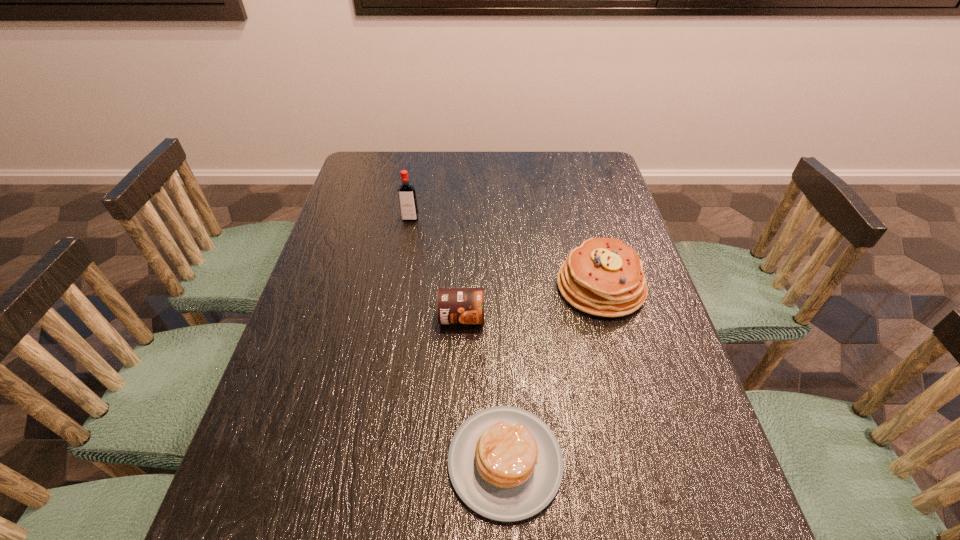
This screenshot has height=540, width=960. What are the coordinates of `free space that is in between the can and the taller pancake` in the screenshot? It's located at (531, 302).

This screenshot has height=540, width=960. In order to click on vacant area that lies between the nearest object and the leftmost object in this screenshot , I will do `click(458, 340)`.

Find the location of `free space that is in between the left pancake and the second shortest object`. free space that is in between the left pancake and the second shortest object is located at coordinates (484, 389).

Locate an element on the screen. This screenshot has height=540, width=960. unoccupied position between the can and the right pancake is located at coordinates (531, 302).

Locate an element on the screen. The height and width of the screenshot is (540, 960). free area in between the leftmost object and the third tallest object is located at coordinates (436, 268).

Where is `vacant space that's between the can and the leftmost object`? vacant space that's between the can and the leftmost object is located at coordinates (436, 268).

Identify the location of free space between the shortest object and the can. Image resolution: width=960 pixels, height=540 pixels. (484, 389).

Locate which object ranks second in proximity to the right pancake. Please provide its 2D coordinates. Your answer should be formatted as a tuple, i.e. [(x, y)], where the tuple contains the x and y coordinates of a point satisfying the conditions above.

[(505, 463)]

Locate an element on the screen. The height and width of the screenshot is (540, 960). the second closest object to the shortest object is located at coordinates (604, 277).

I want to click on free space that satisfies the following two spatial constraints: 1. on the front label of the shortest object; 2. on the right side of the second shortest object, so click(x=456, y=461).